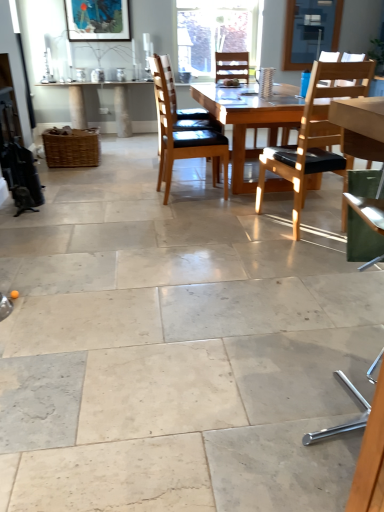
At what (x,y) coordinates should I click in order to perform the action: click on vacant space that is in between brown leather chair at center, which is the 1th chair in back-to-front order, and green fabric chair at right, positioned as the 2th chair in right-to-left order. Please return your answer as a coordinate pair (x, y). Looking at the image, I should click on (250, 289).